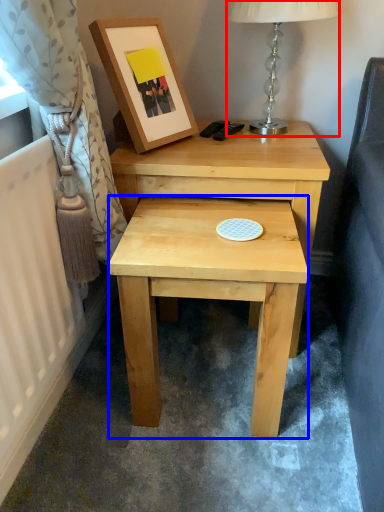
Question: Among these objects, which one is farthest to the camera, table lamp (highlighted by a red box) or stool (highlighted by a blue box)?

Choices:
 (A) table lamp
 (B) stool

Answer: (A)